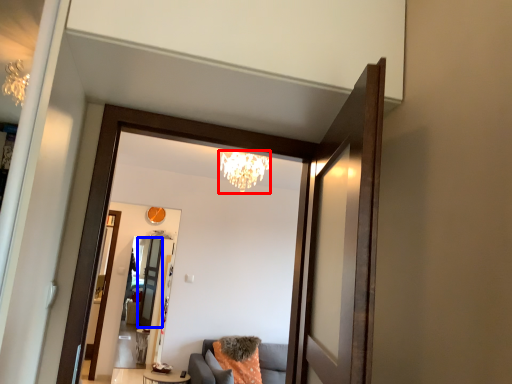
Question: Which object is closer to the camera taking this photo, light fixture (highlighted by a red box) or screen door (highlighted by a blue box)?

Choices:
 (A) light fixture
 (B) screen door

Answer: (A)